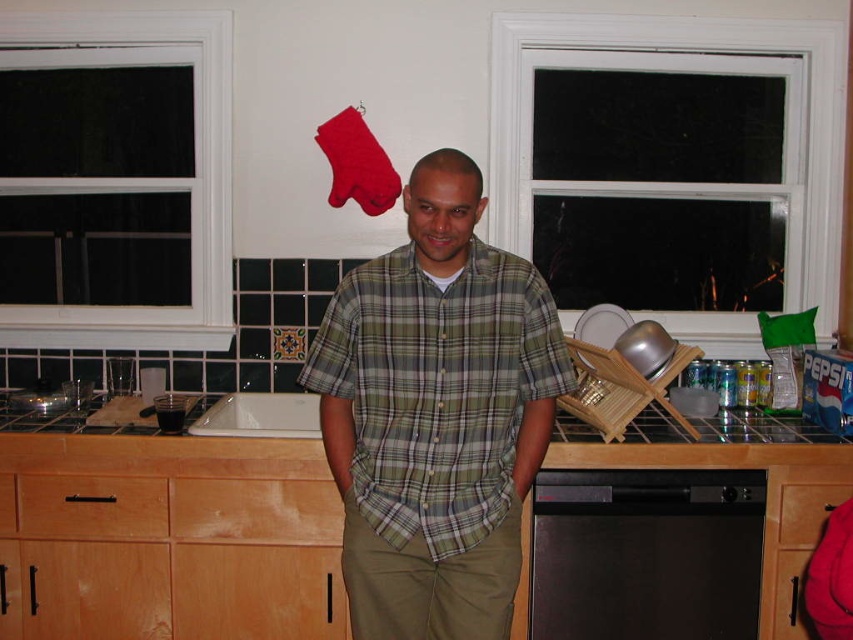
Is black matte dishwasher at lower center above satin wood drawer at center?

No, black matte dishwasher at lower center is not above satin wood drawer at center.

Who is taller, black matte dishwasher at lower center or satin wood drawer at center?

black matte dishwasher at lower center

At what (x,y) coordinates should I click in order to perform the action: click on black matte dishwasher at lower center. Please return your answer as a coordinate pair (x, y). Looking at the image, I should click on (646, 554).

Who is taller, light brown wood drawer at lower center or white glossy sink at center?

Standing taller between the two is light brown wood drawer at lower center.

Who is more forward, (288, 506) or (312, 404)?

Point (288, 506) is in front.

Is point (169, 497) behind point (239, 401)?

That is False.

This screenshot has height=640, width=853. I want to click on light brown wood drawer at lower center, so click(254, 509).

Image resolution: width=853 pixels, height=640 pixels. Describe the element at coordinates (437, 388) in the screenshot. I see `green plaid shirt at center` at that location.

Does green plaid shirt at center appear on the right side of white glossy sink at center?

Correct, you'll find green plaid shirt at center to the right of white glossy sink at center.

Is point (518, 358) less distant than point (293, 433)?

Yes, it is.

Locate an element on the screen. green plaid shirt at center is located at coordinates (437, 388).